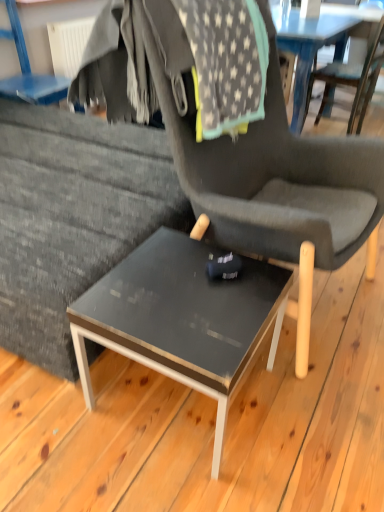
Question: Is wooden chair at center, arranged as the first chair when viewed from the right, taller than matte gray chair at upper left, arranged as the 1th chair when viewed from the left?

Choices:
 (A) yes
 (B) no

Answer: (A)

Question: From a real-world perspective, is wooden chair at center, which is the 3th chair in left-to-right order, below matte gray chair at upper left, arranged as the third chair when viewed from the right?

Choices:
 (A) yes
 (B) no

Answer: (A)

Question: Is wooden chair at center, arranged as the first chair when viewed from the right, placed right next to matte gray chair at upper left, arranged as the 1th chair when viewed from the left?

Choices:
 (A) no
 (B) yes

Answer: (A)

Question: Can you confirm if wooden chair at center, which is the 3th chair in left-to-right order, is smaller than matte gray chair at upper left, arranged as the third chair when viewed from the right?

Choices:
 (A) yes
 (B) no

Answer: (B)

Question: Does wooden chair at center, which is the 3th chair in left-to-right order, come behind matte gray chair at upper left, arranged as the 1th chair when viewed from the left?

Choices:
 (A) no
 (B) yes

Answer: (B)

Question: From the image's perspective, is wooden chair at center, arranged as the first chair when viewed from the right, on matte gray chair at upper left, arranged as the 1th chair when viewed from the left?

Choices:
 (A) yes
 (B) no

Answer: (A)

Question: Can you confirm if wooden chair at center, arranged as the first chair when viewed from the right, is taller than matte black chair at center, the 2th chair from the left?

Choices:
 (A) yes
 (B) no

Answer: (B)

Question: Does wooden chair at center, which is the 3th chair in left-to-right order, have a lesser height compared to matte black chair at center, the 2th chair in the right-to-left sequence?

Choices:
 (A) no
 (B) yes

Answer: (B)

Question: Is wooden chair at center, which is the 3th chair in left-to-right order, closer to the viewer compared to matte black chair at center, the 2th chair in the right-to-left sequence?

Choices:
 (A) yes
 (B) no

Answer: (B)

Question: Is wooden chair at center, which is the 3th chair in left-to-right order, to the left of matte black chair at center, the 2th chair from the left, from the viewer's perspective?

Choices:
 (A) no
 (B) yes

Answer: (A)

Question: Could matte black chair at center, the 2th chair from the left, be considered to be inside wooden chair at center, arranged as the first chair when viewed from the right?

Choices:
 (A) no
 (B) yes

Answer: (A)

Question: From a real-world perspective, is wooden chair at center, arranged as the first chair when viewed from the right, located beneath matte black chair at center, the 2th chair in the right-to-left sequence?

Choices:
 (A) yes
 (B) no

Answer: (A)

Question: Is wooden chair at center, arranged as the first chair when viewed from the right, behind matte black table at center?

Choices:
 (A) no
 (B) yes

Answer: (B)